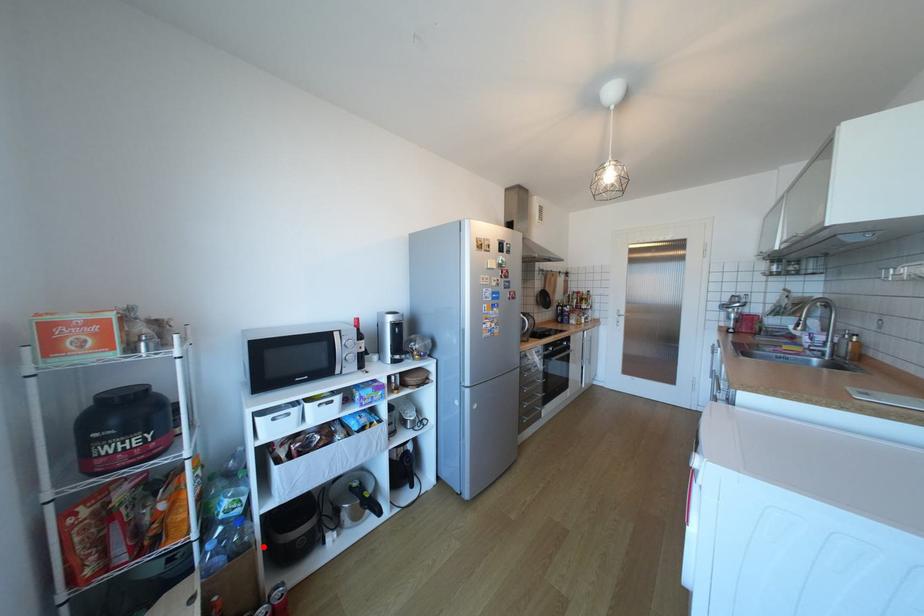
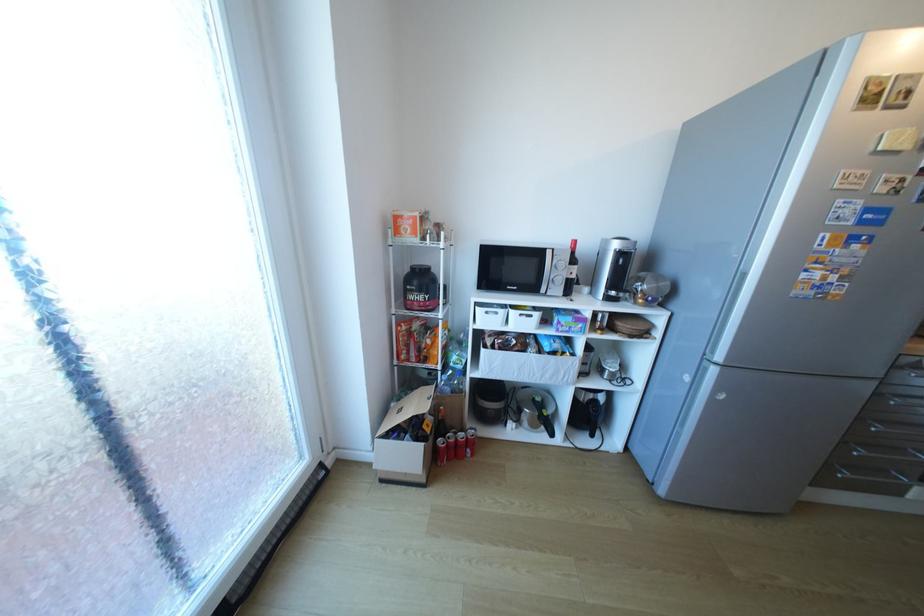
The point at the highlighted location is marked in the first image. Where is the corresponding point in the second image?

(472, 394)